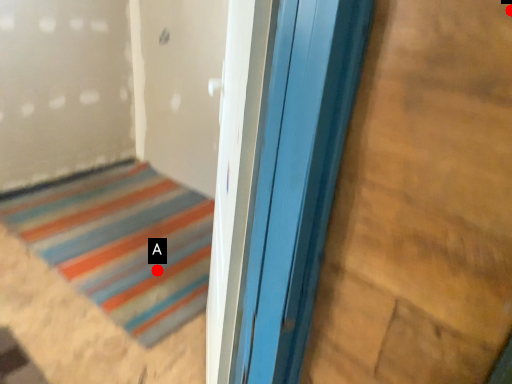
Question: Two points are circled on the image, labeled by A and B beside each circle. Which point appears closest to the camera in this image?

Choices:
 (A) A is closer
 (B) B is closer

Answer: (B)